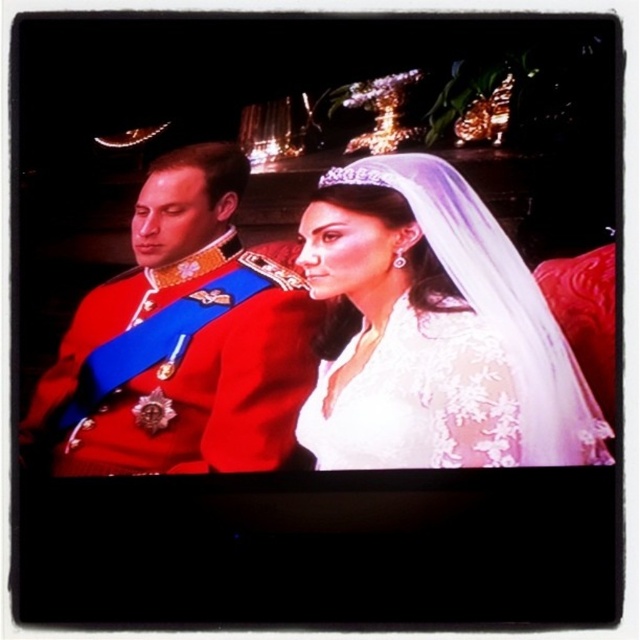
Question: Which object appears closest to the camera in this image?

Choices:
 (A) clear crystal tiara at upper center
 (B) white lace veil at upper center
 (C) white lace dress at center

Answer: (C)

Question: Based on their relative distances, which object is farther from the white lace veil at upper center?

Choices:
 (A) shiny red uniform at left
 (B) clear crystal tiara at upper center

Answer: (B)

Question: Which point is closer to the camera?

Choices:
 (A) (445, 433)
 (B) (458, 465)
 (C) (214, 385)

Answer: (A)

Question: Is white lace veil at upper center thinner than clear crystal tiara at upper center?

Choices:
 (A) yes
 (B) no

Answer: (B)

Question: Does white lace dress at center appear under clear crystal tiara at upper center?

Choices:
 (A) no
 (B) yes

Answer: (B)

Question: Can you confirm if white lace veil at upper center is positioned to the right of shiny red uniform at left?

Choices:
 (A) yes
 (B) no

Answer: (A)